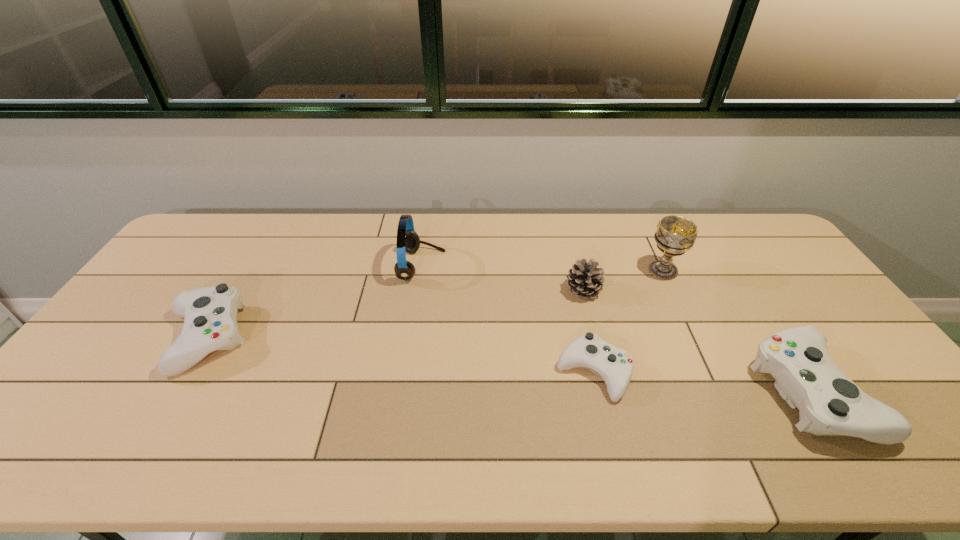
This screenshot has height=540, width=960. Find the location of `free location located on the left of the rightmost object`. free location located on the left of the rightmost object is located at coordinates (685, 392).

Where is `vacant point located with the microphone attached to the side of the headset`? This screenshot has height=540, width=960. vacant point located with the microphone attached to the side of the headset is located at coordinates (547, 266).

Locate an element on the screen. The width and height of the screenshot is (960, 540). free space located 0.230m on the back of the fifth object from left to right is located at coordinates (639, 220).

Identify the location of vacant space located 0.370m on the left of the pinecone. (445, 291).

Identify the location of object situated at the far edge. pos(408,240).

This screenshot has width=960, height=540. I want to click on object that is at the left edge, so click(x=210, y=323).

Find the location of a particular element. object located at the right edge is located at coordinates tap(830, 404).

This screenshot has width=960, height=540. I want to click on object that is at the near right corner, so click(x=830, y=404).

The height and width of the screenshot is (540, 960). I want to click on vacant space at the far edge, so click(x=428, y=253).

In order to click on free point at the near edge in this screenshot , I will do `click(243, 400)`.